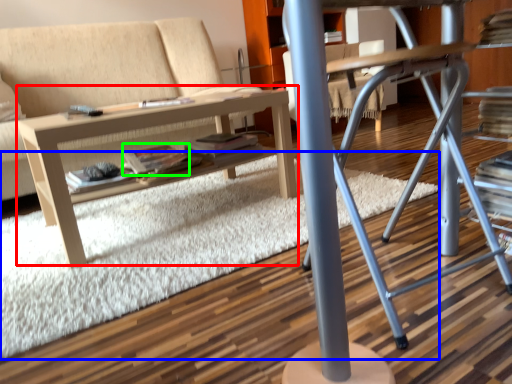
Question: Which is farther away from table (highlighted by a red box)? plain (highlighted by a blue box) or paperback book (highlighted by a green box)?

Choices:
 (A) plain
 (B) paperback book

Answer: (A)